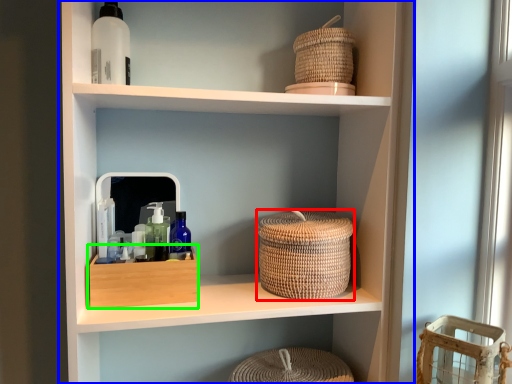
Question: Based on their relative distances, which object is farther from basket (highlighted by a red box)? Choose from shelf (highlighted by a blue box) and storage box (highlighted by a green box).

Choices:
 (A) shelf
 (B) storage box

Answer: (B)